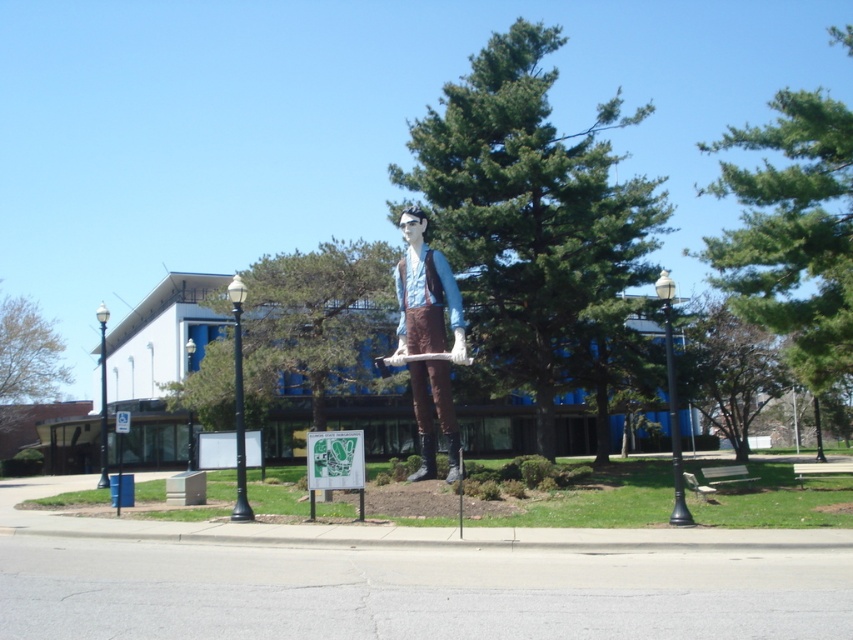
Can you confirm if green textured tree at center is positioned to the left of black metal pole at right?

No, green textured tree at center is not to the left of black metal pole at right.

Between green textured tree at center and black metal pole at right, which one appears on the left side from the viewer's perspective?

black metal pole at right

Who is more forward, (517, 342) or (665, 336)?

Point (665, 336) is in front.

At what (x,y) coordinates should I click in order to perform the action: click on green textured tree at center. Please return your answer as a coordinate pair (x, y). The height and width of the screenshot is (640, 853). Looking at the image, I should click on (531, 216).

Can you confirm if green textured tree at center is positioned above black metal pole at left?

Yes.

You are a GUI agent. You are given a task and a screenshot of the screen. Output one action in this format:
    pyautogui.click(x=<x>, y=<y>)
    Task: Click on the green textured tree at center
    The image size is (853, 640).
    Given the screenshot: What is the action you would take?
    pyautogui.click(x=531, y=216)

Does green leafy tree at upper left have a smaller size compared to brushed metal pole at left?

Incorrect, green leafy tree at upper left is not smaller in size than brushed metal pole at left.

Who is more distant from viewer, [0,417] or [105,440]?

The point [0,417] is behind.

Based on the photo, who is more forward, (15, 310) or (100, 376)?

Point (15, 310) is more forward.

What are the coordinates of `green leafy tree at upper left` in the screenshot? It's located at click(x=25, y=369).